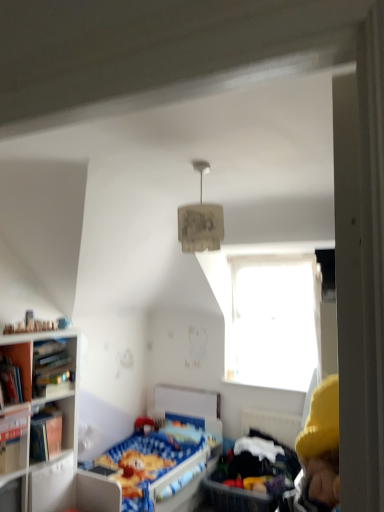
Question: Is hardcover book at left, acting as the 2th book starting from the bottom, closer to the viewer compared to hardcover book at left, placed as the second book when sorted from top to bottom?

Choices:
 (A) yes
 (B) no

Answer: (B)

Question: From the image's perspective, is hardcover book at left, the 1th book viewed from the top, above hardcover book at left, placed as the second book when sorted from top to bottom?

Choices:
 (A) no
 (B) yes

Answer: (B)

Question: Is hardcover book at left, acting as the 2th book starting from the bottom, wider than hardcover book at left, which is the 1th book from bottom to top?

Choices:
 (A) no
 (B) yes

Answer: (A)

Question: Considering the relative positions of hardcover book at left, the 1th book viewed from the top, and hardcover book at left, which is the 1th book from bottom to top, in the image provided, is hardcover book at left, the 1th book viewed from the top, to the right of hardcover book at left, which is the 1th book from bottom to top, from the viewer's perspective?

Choices:
 (A) yes
 (B) no

Answer: (B)

Question: Would you say hardcover book at left, acting as the 2th book starting from the bottom, is a long distance from hardcover book at left, placed as the second book when sorted from top to bottom?

Choices:
 (A) yes
 (B) no

Answer: (B)

Question: Is hardcover book at left, the 1th book viewed from the top, aimed at hardcover book at left, placed as the second book when sorted from top to bottom?

Choices:
 (A) no
 (B) yes

Answer: (A)

Question: From the image's perspective, is wooden bookshelf at left below transparent glass window at upper center?

Choices:
 (A) yes
 (B) no

Answer: (A)

Question: Is wooden bookshelf at left facing away from transparent glass window at upper center?

Choices:
 (A) no
 (B) yes

Answer: (A)

Question: Is wooden bookshelf at left located outside transparent glass window at upper center?

Choices:
 (A) no
 (B) yes

Answer: (B)

Question: Considering the relative positions of wooden bookshelf at left and transparent glass window at upper center in the image provided, is wooden bookshelf at left to the right of transparent glass window at upper center from the viewer's perspective?

Choices:
 (A) no
 (B) yes

Answer: (A)

Question: Is wooden bookshelf at left next to transparent glass window at upper center and touching it?

Choices:
 (A) yes
 (B) no

Answer: (B)

Question: Does wooden bookshelf at left appear on the left side of transparent glass window at upper center?

Choices:
 (A) yes
 (B) no

Answer: (A)

Question: Considering the relative sizes of transparent glass window at upper center and wooden bookshelf at left in the image provided, is transparent glass window at upper center wider than wooden bookshelf at left?

Choices:
 (A) yes
 (B) no

Answer: (B)